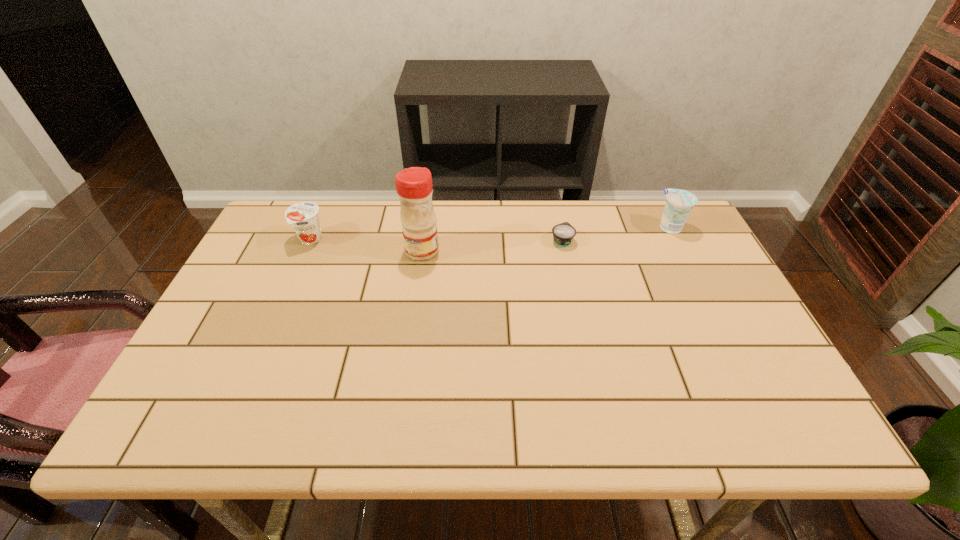
This screenshot has width=960, height=540. In order to click on condiment that is at the far edge in this screenshot , I will do `click(414, 188)`.

You are a GUI agent. You are given a task and a screenshot of the screen. Output one action in this format:
    pyautogui.click(x=<x>, y=<y>)
    Task: Click on the object at the left edge
    The width and height of the screenshot is (960, 540).
    Given the screenshot: What is the action you would take?
    pyautogui.click(x=303, y=216)

This screenshot has height=540, width=960. In order to click on object that is positioned at the right edge in this screenshot , I will do `click(679, 203)`.

Find the location of a particular element. object present at the far left corner is located at coordinates (303, 216).

Image resolution: width=960 pixels, height=540 pixels. I want to click on object positioned at the far right corner, so tap(679, 203).

In the image, there is a desktop. Find the location of `blank space at the far edge`. blank space at the far edge is located at coordinates (592, 218).

The image size is (960, 540). In the image, there is a desktop. Identify the location of blank space at the left edge. (281, 262).

Identify the location of vacant space at the right edge of the desktop. (745, 367).

The height and width of the screenshot is (540, 960). In the image, there is a desktop. Find the location of `blank space at the far right corner`. blank space at the far right corner is located at coordinates (652, 200).

Identify the location of blank space at the near right corner. This screenshot has width=960, height=540. (802, 436).